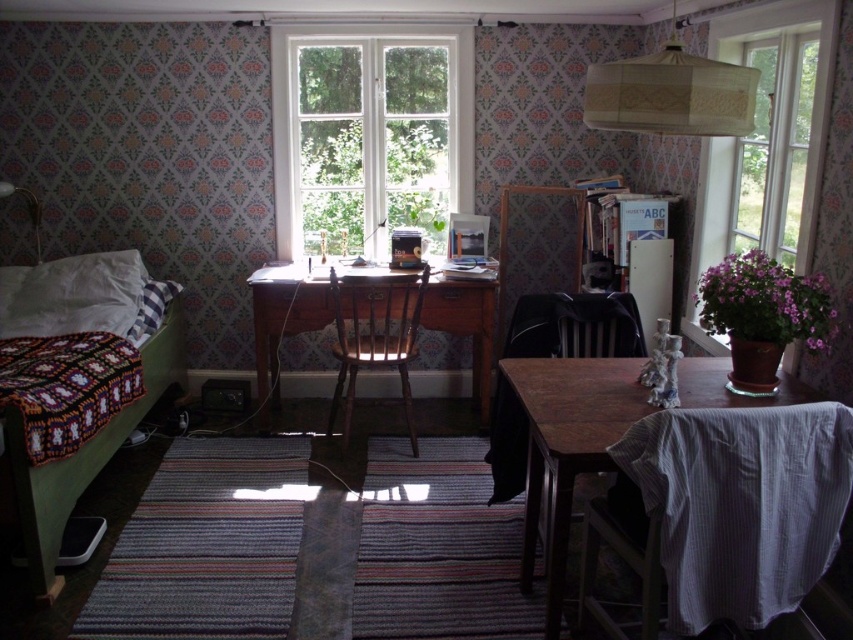
You are standing in the room and want to know how far the point at coordinates [791,198] is from your current position. Can you determine the distance?

The point at coordinates [791,198] is 2.69 meters away from the camera, so the distance from your current position would be approximately 2.69 meters.

You are organizing a small gathering in the room and need to place a 1.2 meter wide table. Can the transparent glass window at right and the wooden chair at center accommodate this table between them?

The transparent glass window at right is smaller than the wooden chair at center. Since the table is 1.2 meters wide, the space between them must be at least that size. However, without knowing the exact distance between them, it is impossible to determine if the table will fit.

You are a delivery person who needs to place a package on the desk between the beige fabric lampshade at upper center and the wooden chair at center. The package is 2 meters long. Can you fit it there?

The distance between the beige fabric lampshade at upper center and the wooden chair at center is 1.90 meters. Since the package is 2 meters long, it is slightly too long to fit in the available space.